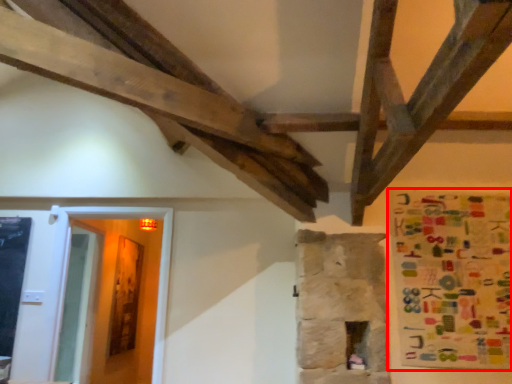
Question: Observing the image, what is the correct spatial positioning of poster (annotated by the red box) in reference to glass door?

Choices:
 (A) left
 (B) right

Answer: (B)